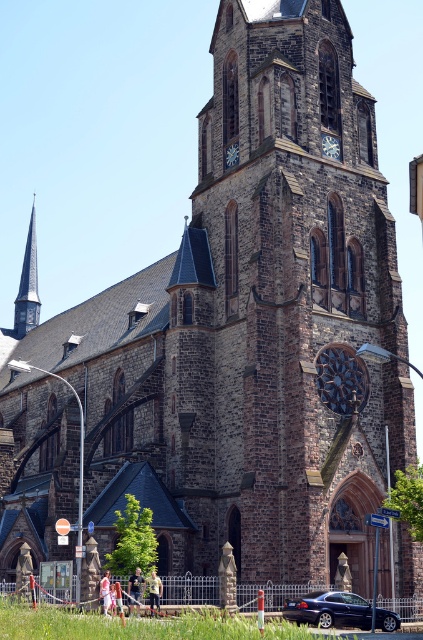
Between point (359, 602) and point (107, 580), which one is positioned in front?

Point (107, 580)

Looking at this image, which is above, metallic blue sedan at lower right or light pink fabric at center?

Positioned higher is light pink fabric at center.

Does point (343, 595) come behind point (107, 595)?

Yes.

This screenshot has width=423, height=640. Find the location of `metallic blue sedan at lower right`. metallic blue sedan at lower right is located at coordinates (329, 609).

Which is more to the left, light brown leather jacket at center or light pink fabric at center?

From the viewer's perspective, light pink fabric at center appears more on the left side.

Does point (140, 577) come closer to viewer compared to point (104, 595)?

No.

Is point (140, 577) behind point (102, 608)?

Yes, it is behind point (102, 608).

Locate an element on the screen. light brown leather jacket at center is located at coordinates (134, 588).

Which is below, white stone clock at upper center or light pink fabric at lower center?

Positioned lower is light pink fabric at lower center.

Is point (324, 147) closer to camera compared to point (115, 582)?

No, (324, 147) is behind (115, 582).

Where is `white stone clock at upper center`? white stone clock at upper center is located at coordinates (331, 145).